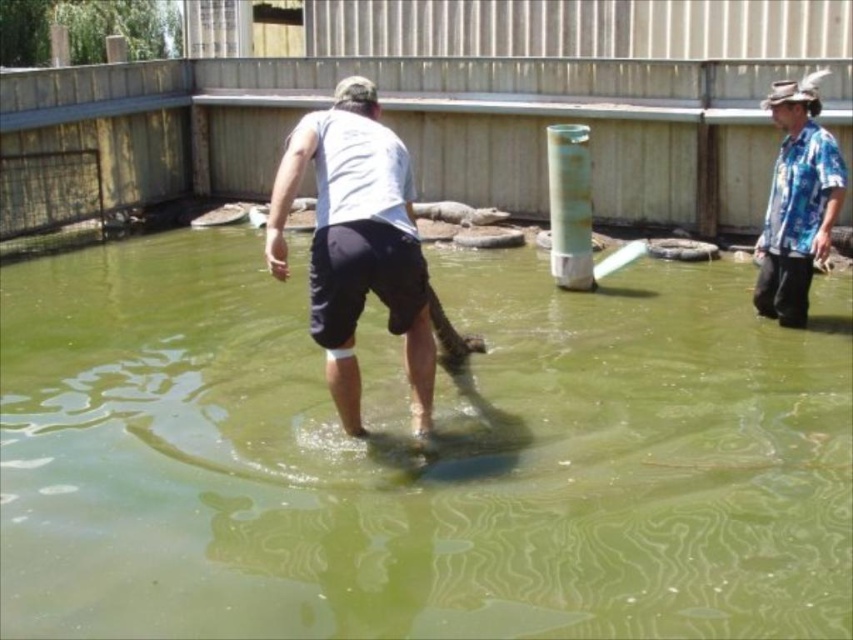
Question: Is green smooth water at center smaller than white matte shorts at center?

Choices:
 (A) yes
 (B) no

Answer: (A)

Question: Which object appears farthest from the camera in this image?

Choices:
 (A) blue floral shirt at right
 (B) green smooth water at center

Answer: (A)

Question: Which of these objects is positioned farthest from the green smooth water at center?

Choices:
 (A) blue floral shirt at right
 (B) white matte shorts at center

Answer: (A)

Question: Can you confirm if green smooth water at center is smaller than blue floral shirt at right?

Choices:
 (A) no
 (B) yes

Answer: (B)

Question: Can you confirm if green smooth water at center is positioned above white matte shorts at center?

Choices:
 (A) yes
 (B) no

Answer: (B)

Question: Among these objects, which one is farthest from the camera?

Choices:
 (A) white matte shorts at center
 (B) blue floral shirt at right

Answer: (B)